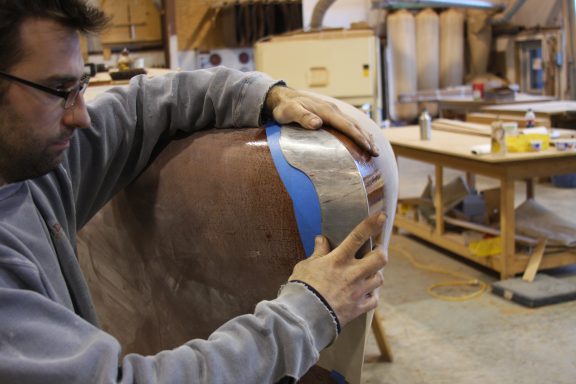
Locate an element on the screen. This screenshot has width=576, height=384. clutter is located at coordinates (469, 213).